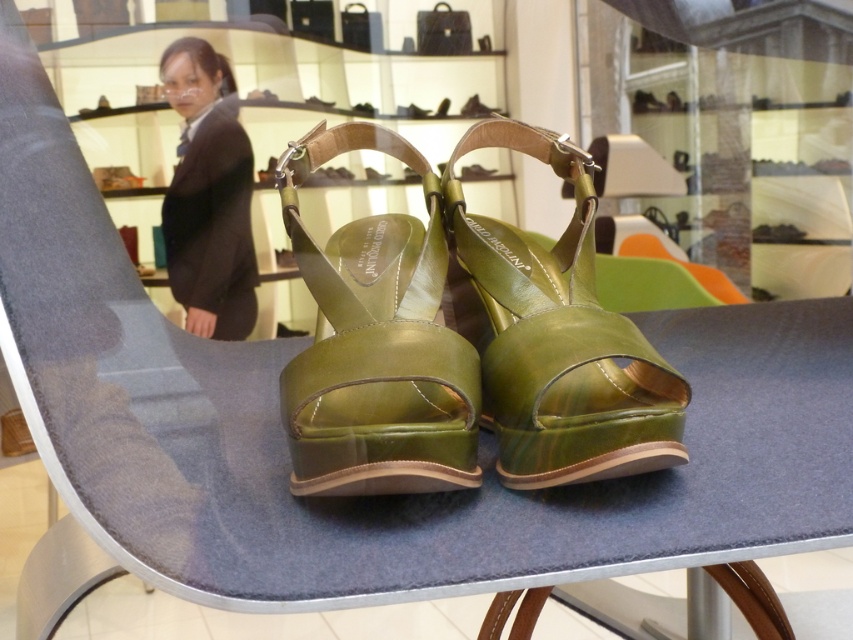
Looking at this image, you are a customer in the store and want to examine both the green leather sandal at center and the metallic green sandal at center. Which one is closer to you when looking at the display?

The green leather sandal at center is closer to you because it is in front of the metallic green sandal at center.

You are a customer in the store and want to know if the green leather sandal at center can fit inside the black fabric suit at upper left. Can it?

The green leather sandal at center is shorter than the black fabric suit at upper left, so it can fit inside.

You are a customer in the store and want to know if the green shiny leather sandals at center can fit into a standard shoebox that is the same width as the black fabric suit at upper left. Can they?

The green shiny leather sandals at center are wider than the black fabric suit at upper left. Since the shoebox has the same width as the suit, the sandals may not fit properly due to their greater width.